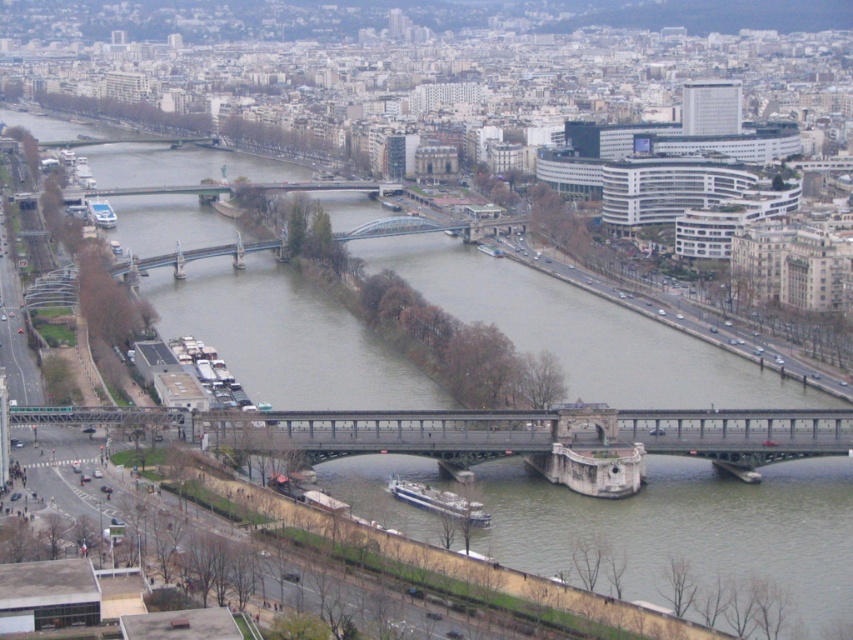
Question: Which point is farther from the camera taking this photo?

Choices:
 (A) (434, 502)
 (B) (230, 412)

Answer: (B)

Question: Is green stone bridge at center to the left of white glossy ship at lower center from the viewer's perspective?

Choices:
 (A) no
 (B) yes

Answer: (B)

Question: Which of the following is the closest to the observer?

Choices:
 (A) (427, 484)
 (B) (91, 208)

Answer: (A)

Question: Among these objects, which one is farthest from the camera?

Choices:
 (A) white glossy boat at upper left
 (B) white glossy ship at lower center
 (C) green stone bridge at center

Answer: (A)

Question: Does green stone bridge at center have a smaller size compared to white glossy ship at lower center?

Choices:
 (A) yes
 (B) no

Answer: (B)

Question: Is green stone bridge at center to the right of white glossy boat at upper left from the viewer's perspective?

Choices:
 (A) yes
 (B) no

Answer: (A)